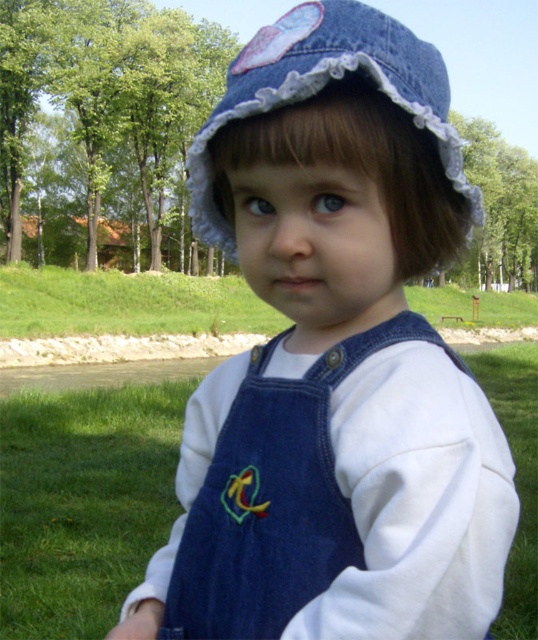
Does point (508, 376) lie in front of point (452, 161)?

No, it is behind (452, 161).

Can you confirm if green grass at lower left is smaller than denim hat at center?

No.

Between point (98, 408) and point (220, 125), which one is positioned in front?

Positioned in front is point (220, 125).

This screenshot has height=640, width=538. In order to click on green grass at lower left in this screenshot , I will do `click(82, 502)`.